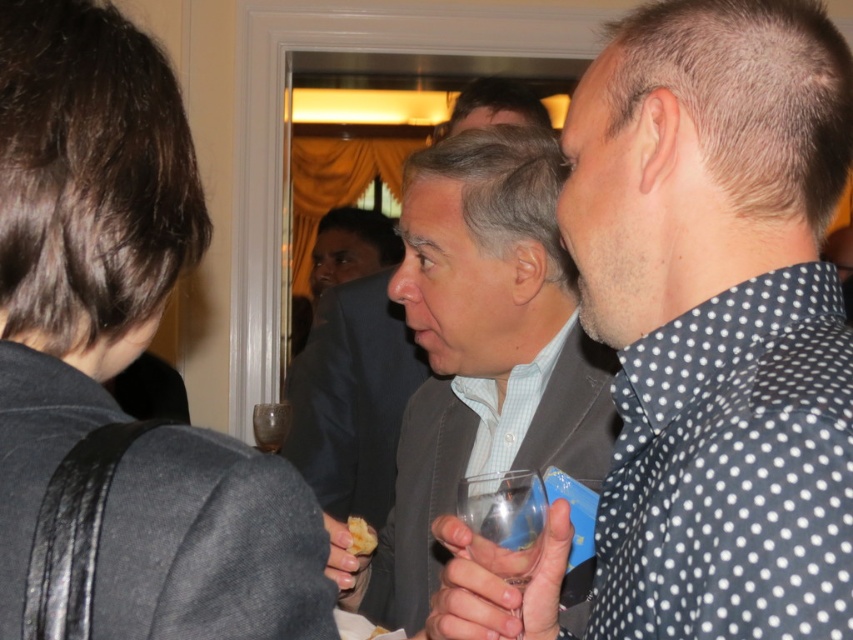
You are at a formal event and see the gray suit jacket at center and the translucent glass wine glass at center. Which object is positioned to the right?

The gray suit jacket at center is to the right of the translucent glass wine glass at center.

You are at a party and want to place a small note on the table between the dark gray fabric at upper left and the translucent glass wine glass at center. Which object should you move to make space?

The dark gray fabric at upper left has a lesser width compared to the translucent glass wine glass at center, so you should move the dark gray fabric at upper left to make space since it takes up less area.

You are at a formal event and need to place a small decorative item on the table. Which object, the dark gray fabric at upper left or the translucent glass wine glass at center, would be more suitable to place the item on top of?

The translucent glass wine glass at center is larger than the dark gray fabric at upper left, so placing the decorative item on the translucent glass wine glass at center would provide a more stable and suitable surface.